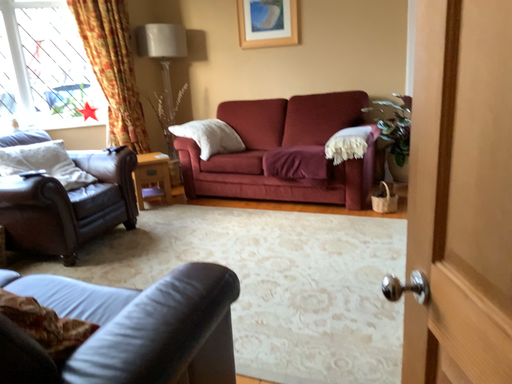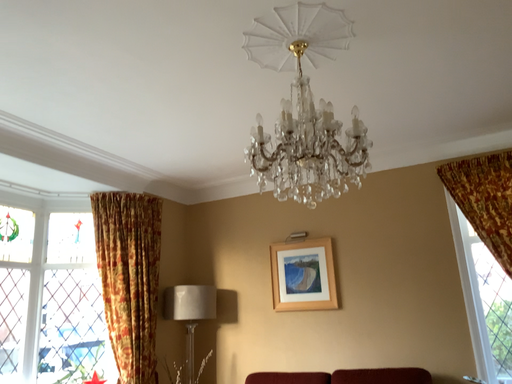
Question: Which way did the camera rotate in the video?

Choices:
 (A) rotated downward
 (B) rotated upward

Answer: (B)